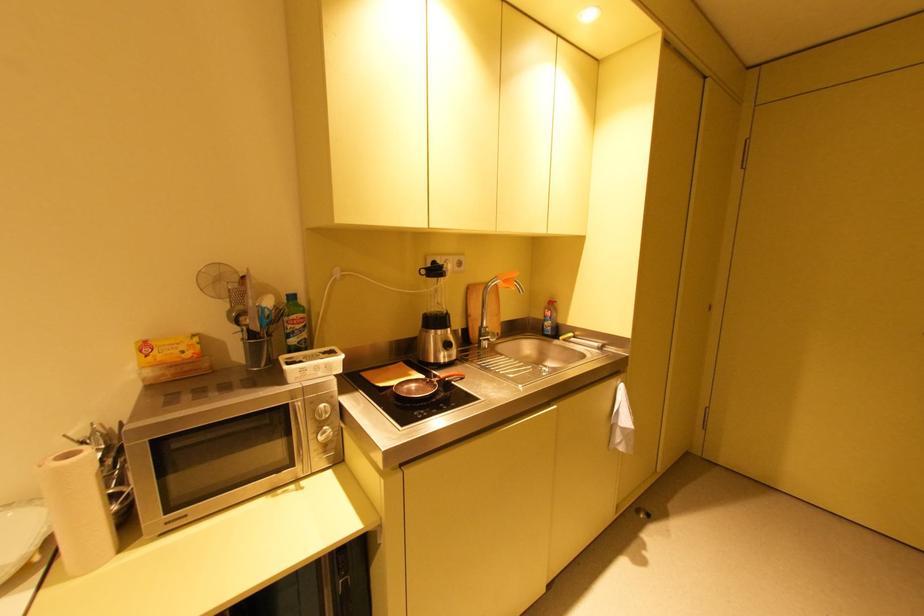
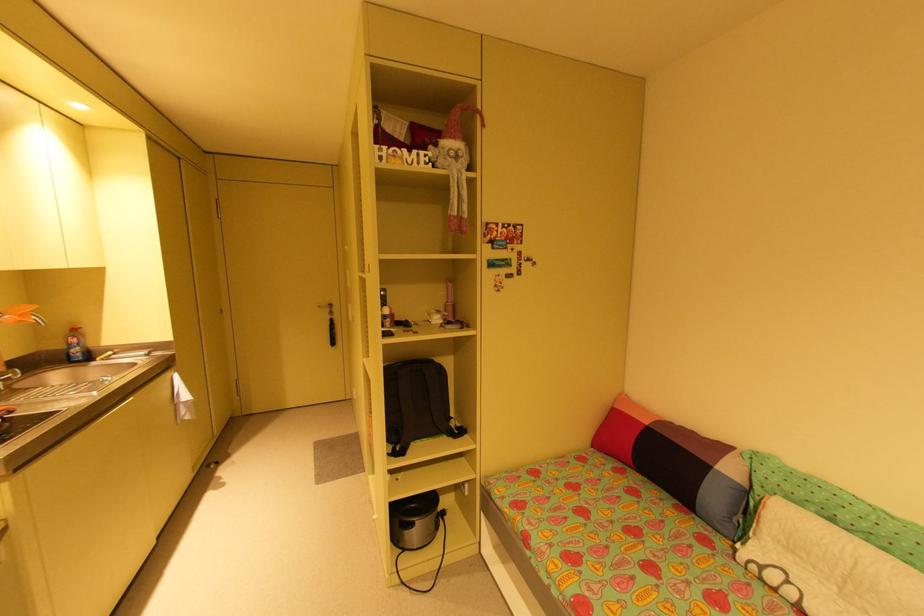
Locate, in the second image, the point that corresponds to (x=508, y=282) in the first image.

(25, 315)